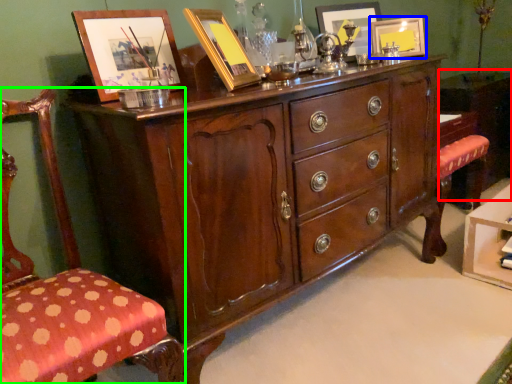
Question: Based on their relative distances, which object is nearer to vanity (highlighted by a red box)? Choose from picture frame (highlighted by a blue box) and chair (highlighted by a green box).

Choices:
 (A) picture frame
 (B) chair

Answer: (A)